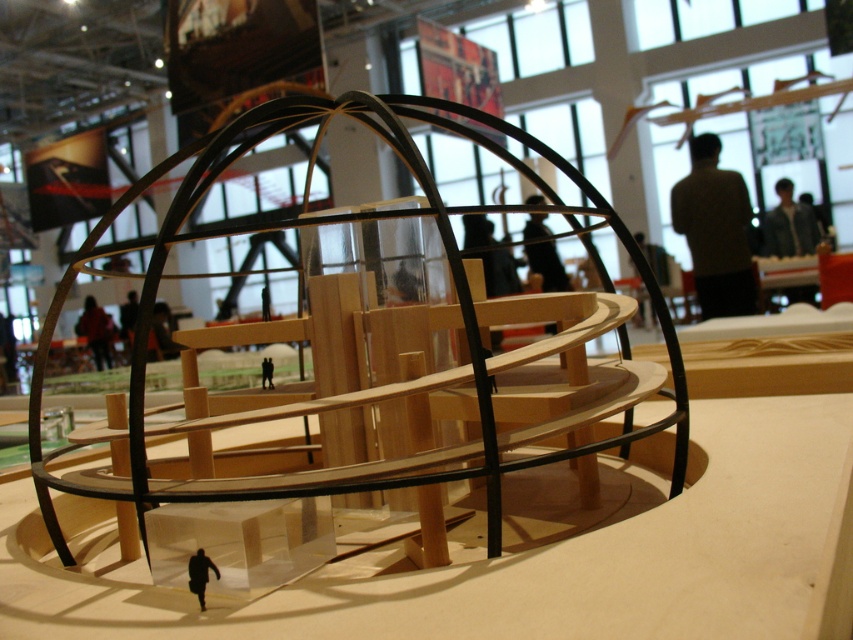
Which is above, denim jacket at upper right or black matte figure at lower center?

Positioned higher is denim jacket at upper right.

Who is more forward, (772, 211) or (201, 600)?

Point (201, 600)

This screenshot has height=640, width=853. What do you see at coordinates (788, 225) in the screenshot? I see `denim jacket at upper right` at bounding box center [788, 225].

Image resolution: width=853 pixels, height=640 pixels. In order to click on denim jacket at upper right in this screenshot , I will do `click(788, 225)`.

Who is higher up, denim jacket at upper right or dark brown leather jacket at center?

denim jacket at upper right is higher up.

Which is more to the left, denim jacket at upper right or dark brown leather jacket at center?

dark brown leather jacket at center

Is point (763, 225) positioned before point (108, 365)?

No.

At what (x,y) coordinates should I click in order to perform the action: click on denim jacket at upper right. Please return your answer as a coordinate pair (x, y). The width and height of the screenshot is (853, 640). Looking at the image, I should click on (788, 225).

Between point (107, 330) and point (213, 563), which one is positioned behind?

The point (107, 330) is more distant.

Which is more to the left, dark brown leather jacket at center or black matte figure at lower center?

dark brown leather jacket at center is more to the left.

Which is in front, point (90, 317) or point (204, 560)?

Point (204, 560) is more forward.

Locate an element on the screen. The image size is (853, 640). dark brown leather jacket at center is located at coordinates (96, 330).